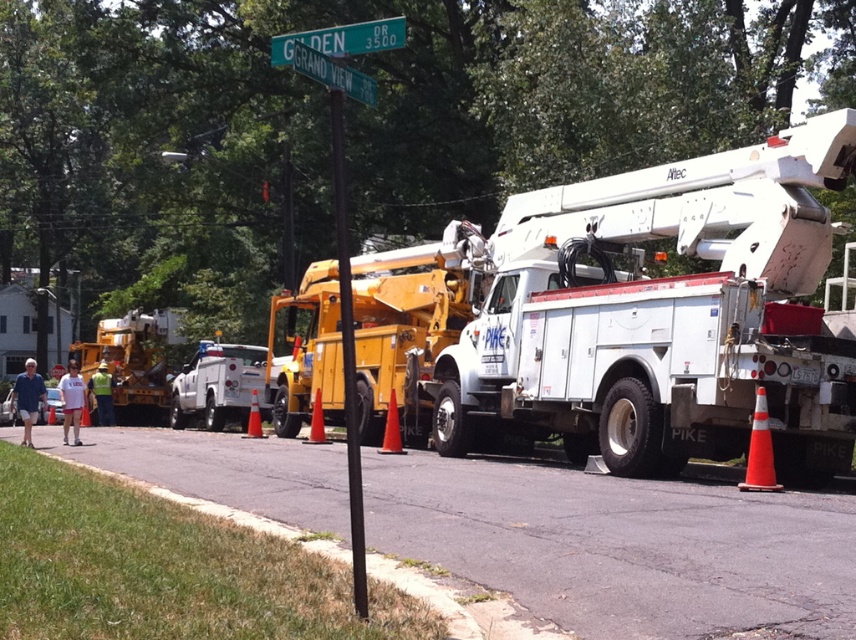
Question: Which of the following is the farthest from the observer?

Choices:
 (A) [x=299, y=68]
 (B) [x=343, y=317]
 (C) [x=749, y=449]

Answer: (C)

Question: Is green plastic street sign at upper center closer to the viewer compared to orange matte traffic cone at center?

Choices:
 (A) yes
 (B) no

Answer: (A)

Question: Is black metal pole at center positioned behind orange matte traffic cone at center?

Choices:
 (A) no
 (B) yes

Answer: (A)

Question: Which object is farther from the camera taking this photo?

Choices:
 (A) yellow metallic utility truck at center
 (B) black metal pole at center

Answer: (A)

Question: Observing the image, what is the correct spatial positioning of white metallic utility truck at center in reference to green plastic street sign at upper center?

Choices:
 (A) above
 (B) below

Answer: (B)

Question: Which point is farther to the camera?

Choices:
 (A) orange plastic traffic cone at center
 (B) orange matte traffic cone at center
 (C) orange reflective cone at lower right

Answer: (A)